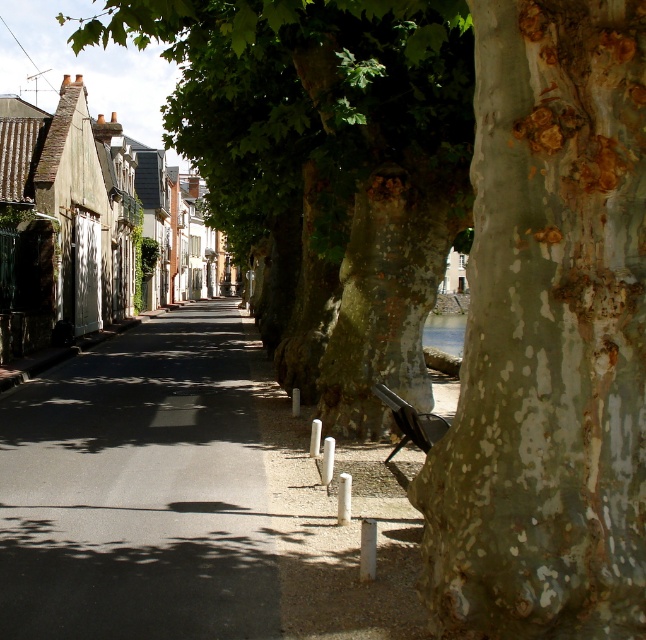
Question: Which point appears closest to the camera in this image?

Choices:
 (A) (342, 538)
 (B) (470, 412)

Answer: (B)

Question: From the image, what is the correct spatial relationship of speckled bark tree trunk at center in relation to smooth bark tree at center?

Choices:
 (A) above
 (B) below

Answer: (B)

Question: Is asphalt road at center closer to camera compared to smooth bark tree at center?

Choices:
 (A) no
 (B) yes

Answer: (B)

Question: Which of these objects is positioned farthest from the smooth bark tree at center?

Choices:
 (A) asphalt road at center
 (B) speckled bark tree trunk at center

Answer: (B)

Question: Which object is the farthest from the smooth bark tree at center?

Choices:
 (A) speckled bark tree trunk at center
 (B) asphalt road at center

Answer: (A)

Question: Is asphalt road at center thinner than smooth bark tree at center?

Choices:
 (A) no
 (B) yes

Answer: (A)